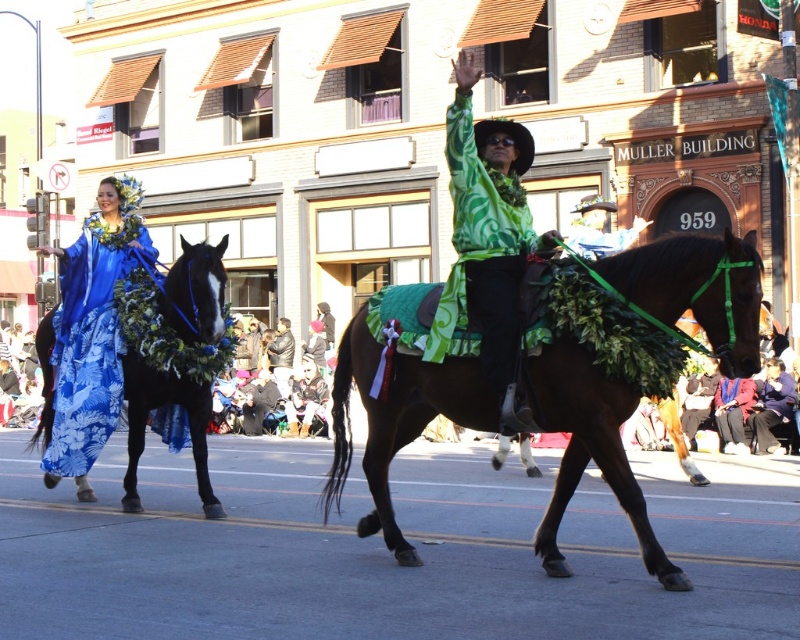
Question: Estimate the real-world distances between objects in this image. Which object is closer to the shiny blue fabric horse at left?

Choices:
 (A) green fabric horse at center
 (B) green satin shirt at center

Answer: (A)

Question: Estimate the real-world distances between objects in this image. Which object is closer to the green satin shirt at center?

Choices:
 (A) green fabric horse at center
 (B) black leather jacket at center
 (C) shiny blue fabric horse at left

Answer: (A)

Question: Which object is positioned closest to the black leather jacket at center?

Choices:
 (A) green satin shirt at center
 (B) shiny blue fabric horse at left
 (C) green fabric horse at center

Answer: (B)

Question: In this image, where is green satin shirt at center located relative to shiny blue fabric horse at left?

Choices:
 (A) below
 (B) above

Answer: (B)

Question: Is green fabric horse at center above black leather jacket at center?

Choices:
 (A) yes
 (B) no

Answer: (A)

Question: Does green fabric horse at center come in front of green satin shirt at center?

Choices:
 (A) no
 (B) yes

Answer: (A)